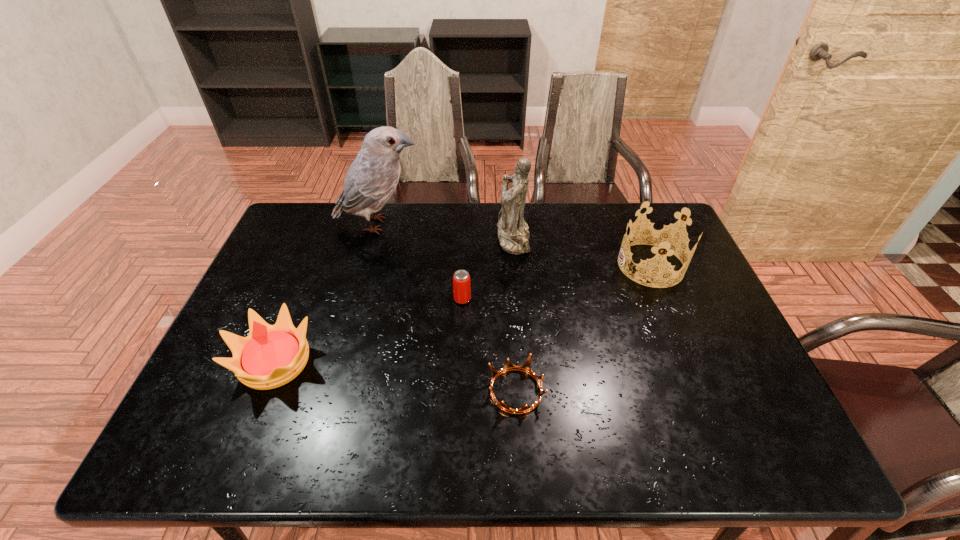
Locate which crown is the third closest to the third object from left to right. Please provide its 2D coordinates. Your answer should be formatted as a tuple, i.e. [(x, y)], where the tuple contains the x and y coordinates of a point satisfying the conditions above.

[(660, 239)]

Identify which crown is located as the third nearest to the fifth shortest object. Please provide its 2D coordinates. Your answer should be formatted as a tuple, i.e. [(x, y)], where the tuple contains the x and y coordinates of a point satisfying the conditions above.

[(270, 356)]

The width and height of the screenshot is (960, 540). I want to click on vacant space that satisfies the following two spatial constraints: 1. on the front-facing side of the parrot; 2. on the back side of the beer can, so click(359, 299).

This screenshot has height=540, width=960. In order to click on vacant area in the image that satisfies the following two spatial constraints: 1. on the front-facing side of the beer can; 2. on the left side of the parrot in this screenshot , I will do `click(359, 299)`.

Find the location of a particular element. This screenshot has width=960, height=540. vacant space that satisfies the following two spatial constraints: 1. on the front-facing side of the rightmost object; 2. on the left side of the figurine is located at coordinates (516, 265).

I want to click on free space that satisfies the following two spatial constraints: 1. on the front-facing side of the rightmost crown; 2. on the right side of the tallest object, so click(369, 265).

Where is `vacant space that satisfies the following two spatial constraints: 1. on the front-facing side of the tallest object; 2. on the back side of the third object from left to right`? vacant space that satisfies the following two spatial constraints: 1. on the front-facing side of the tallest object; 2. on the back side of the third object from left to right is located at coordinates (359, 299).

I want to click on vacant position in the image that satisfies the following two spatial constraints: 1. on the front-facing side of the shortest object; 2. on the right side of the parrot, so click(335, 391).